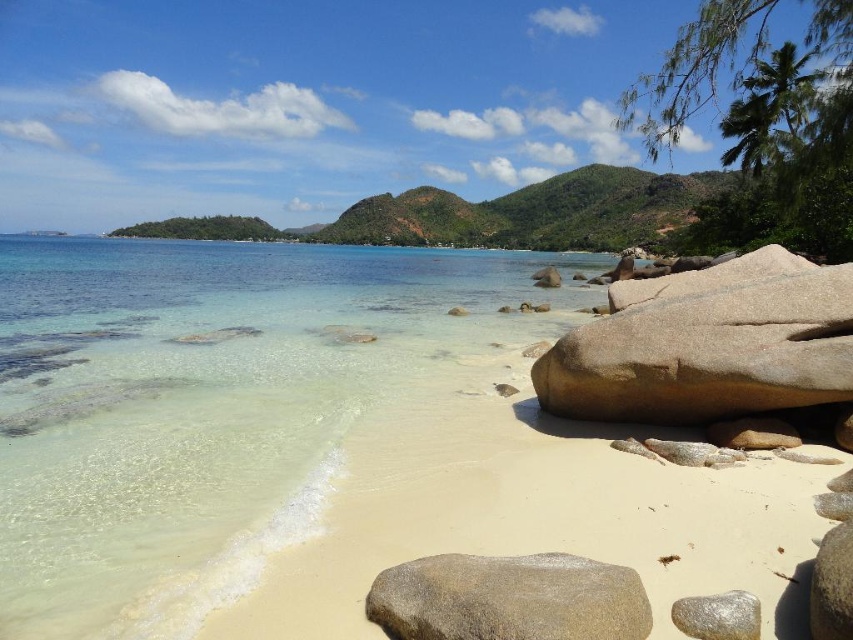
Measure the distance between clear water at beach center and camera.

clear water at beach center is 5.24 meters away from camera.

Does clear water at beach center have a smaller size compared to gray polished rock at lower center?

Actually, clear water at beach center might be larger than gray polished rock at lower center.

Identify the location of clear water at beach center. pos(212,404).

Is brown polished rock at center-right thinner than silver metallic rock at lower right?

Indeed, brown polished rock at center-right has a lesser width compared to silver metallic rock at lower right.

Does brown polished rock at center-right appear under silver metallic rock at lower right?

No, brown polished rock at center-right is not below silver metallic rock at lower right.

In order to click on brown polished rock at center-right in this screenshot , I will do `click(709, 346)`.

The image size is (853, 640). Describe the element at coordinates (709, 346) in the screenshot. I see `brown polished rock at center-right` at that location.

Does brown polished rock at center-right have a greater width compared to gray polished rock at lower center?

No.

Image resolution: width=853 pixels, height=640 pixels. Describe the element at coordinates (709, 346) in the screenshot. I see `brown polished rock at center-right` at that location.

The image size is (853, 640). I want to click on brown polished rock at center-right, so click(709, 346).